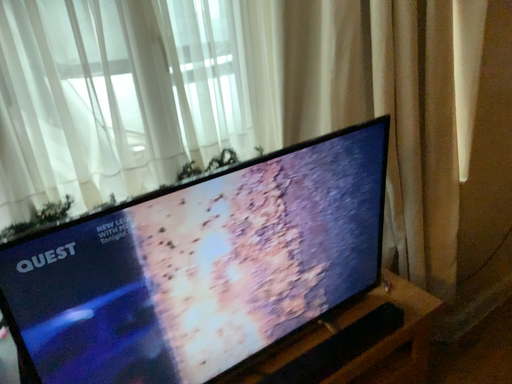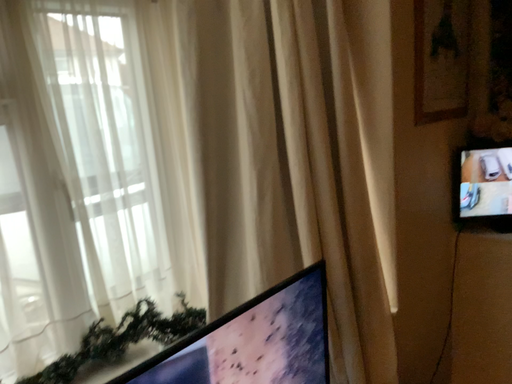
Question: Which way did the camera rotate in the video?

Choices:
 (A) rotated upward
 (B) rotated downward

Answer: (A)